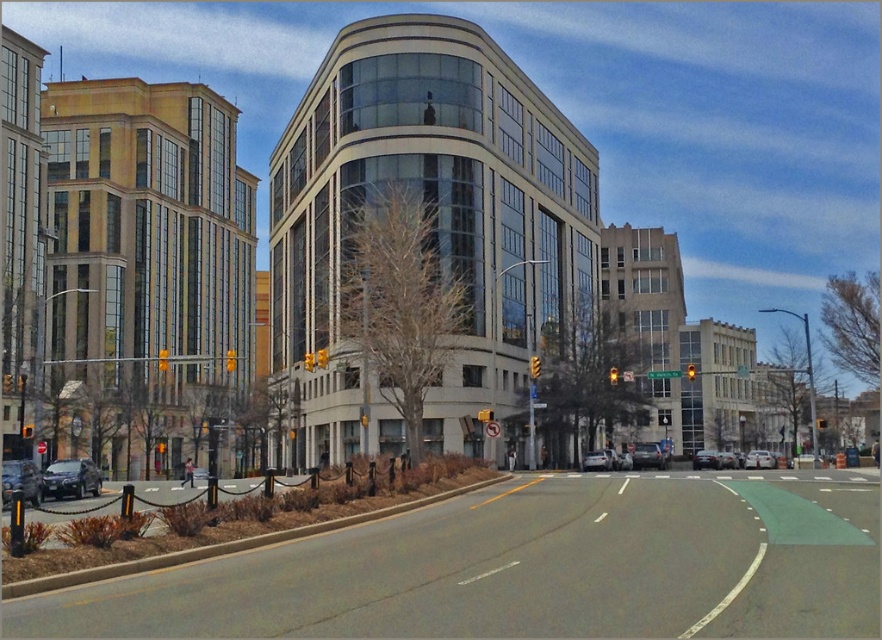
Question: Which is nearer to the white matte car at center?

Choices:
 (A) metallic silver sedan at center
 (B) matte black sedan at center
 (C) shiny silver sedan at lower left

Answer: (A)

Question: Is shiny silver sedan at lower left thinner than silver metallic sedan at center?

Choices:
 (A) yes
 (B) no

Answer: (A)

Question: Based on their relative distances, which object is nearer to the shiny silver sedan at lower left?

Choices:
 (A) silver metallic sedan at center
 (B) matte black sedan at center
 (C) metallic silver sedan at center
 (D) white matte car at center

Answer: (D)

Question: Does metallic silver sedan at center have a larger size compared to matte black sedan at center?

Choices:
 (A) yes
 (B) no

Answer: (B)

Question: Observing the image, what is the correct spatial positioning of metallic silver sedan at center in reference to matte black sedan at center?

Choices:
 (A) below
 (B) above

Answer: (B)

Question: Which object is closer to the camera taking this photo?

Choices:
 (A) white matte car at center
 (B) metallic silver sedan at center
 (C) matte black sedan at center

Answer: (A)